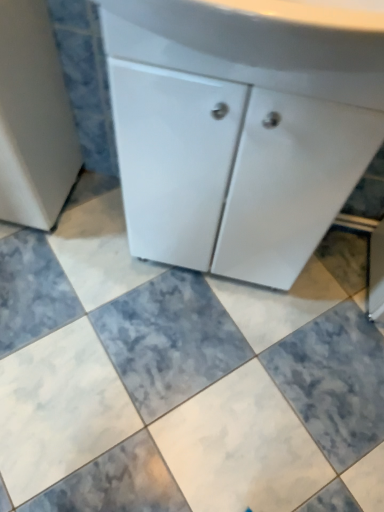
Image resolution: width=384 pixels, height=512 pixels. Identify the location of vacant space in front of white glossy cabinet at center. (196, 346).